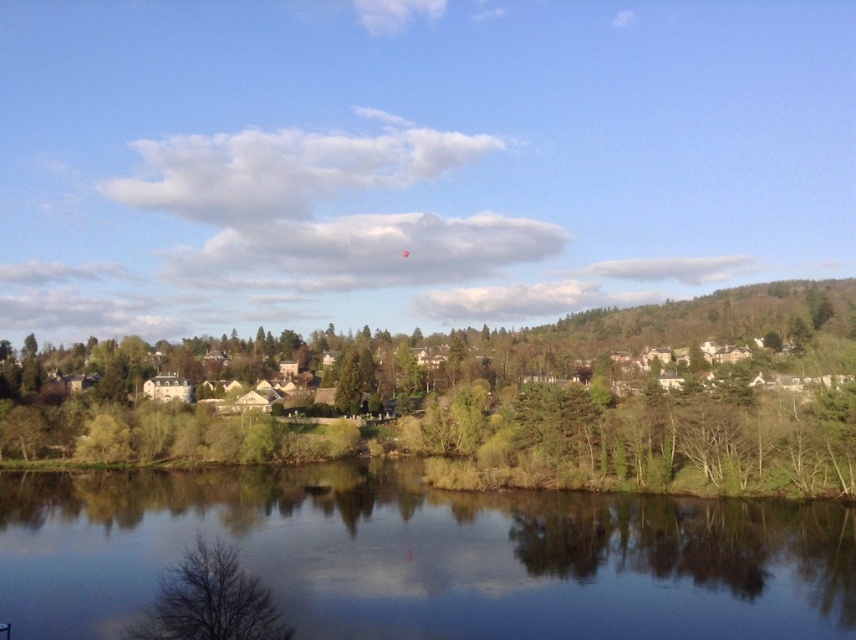
Question: Which object appears closest to the camera in this image?

Choices:
 (A) bare branches at lower left
 (B) transparent water at center
 (C) green leafy tree at left

Answer: (A)

Question: Is green leafy tree at left to the left of transparent water at center from the viewer's perspective?

Choices:
 (A) no
 (B) yes

Answer: (A)

Question: Does green leafy tree at left appear under transparent water at center?

Choices:
 (A) no
 (B) yes

Answer: (A)

Question: Which object appears farthest from the camera in this image?

Choices:
 (A) transparent water at center
 (B) bare branches at lower left

Answer: (A)

Question: Which point is farther to the camera?

Choices:
 (A) (259, 589)
 (B) (780, 456)
 (C) (357, 616)

Answer: (B)

Question: Is transparent water at center to the right of bare branches at lower left from the viewer's perspective?

Choices:
 (A) yes
 (B) no

Answer: (B)